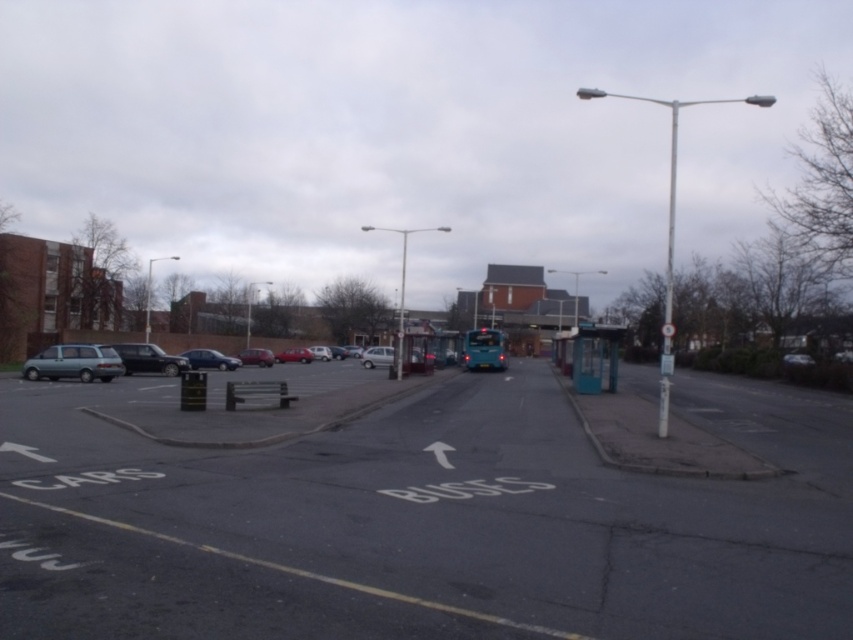
You are a delivery person trying to park your 2.5 meter wide van. You see the black asphalt road at center and the teal plastic bus stop at right. Which area can accommodate your vehicle for parking?

The black asphalt road at center is wider than the teal plastic bus stop at right, so the black asphalt road at center can accommodate your 2.5 meter wide van for parking.